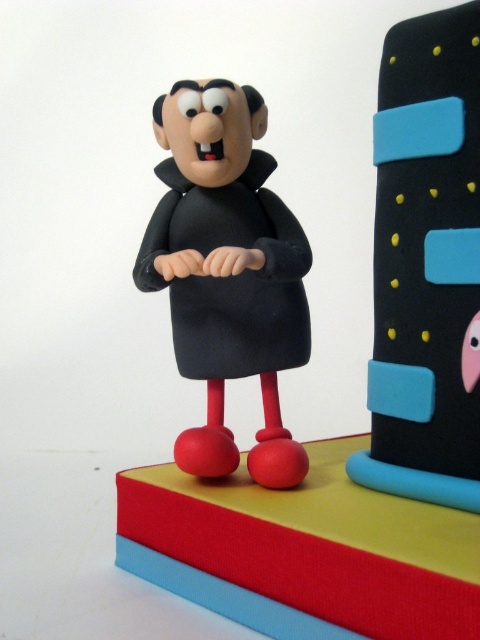
Is matte black tower at upper right positioned before matte black figurine at center?

Yes, it is.

Based on the photo, which is more to the left, matte black tower at upper right or matte black figurine at center?

matte black figurine at center is more to the left.

In order to click on matte black tower at upper right in this screenshot , I will do pyautogui.click(x=427, y=264).